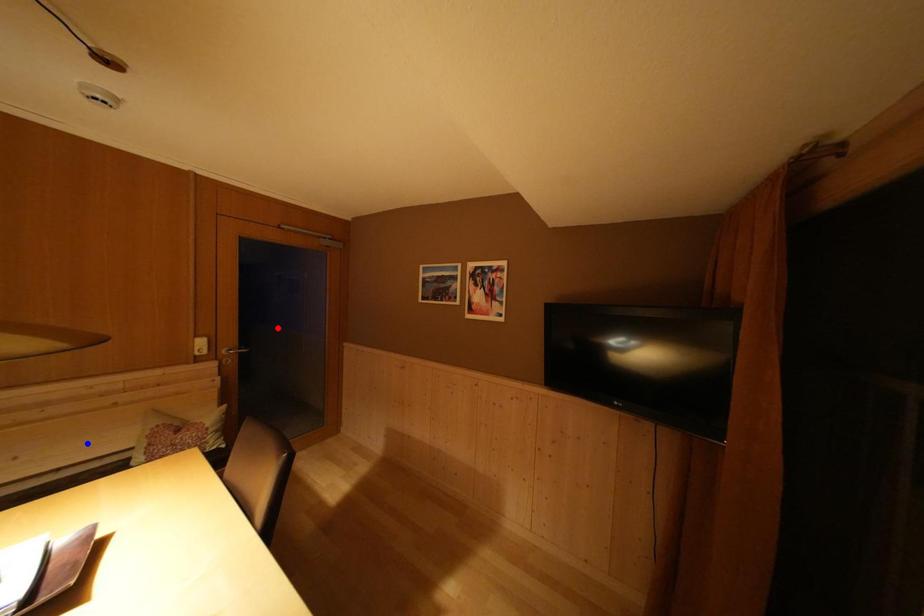
Question: Two points are marked on the image. Which point is closer to the camera?

Choices:
 (A) Blue point is closer.
 (B) Red point is closer.

Answer: (A)